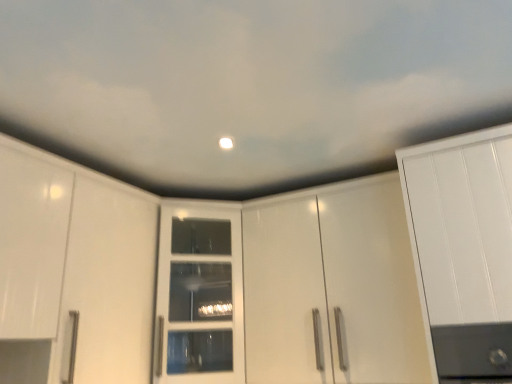
Question: Considering the positions of white glossy cabinet door at center and glossy white cabinet at center in the image, is white glossy cabinet door at center taller or shorter than glossy white cabinet at center?

Choices:
 (A) tall
 (B) short

Answer: (B)

Question: From a real-world perspective, is white glossy cabinet door at center above or below glossy white cabinet at center?

Choices:
 (A) below
 (B) above

Answer: (B)

Question: Would you say white glossy cabinet door at center is inside or outside glossy white cabinet at center?

Choices:
 (A) outside
 (B) inside

Answer: (A)

Question: Is glossy white cabinet at center wider or thinner than white glossy cabinet door at center?

Choices:
 (A) thin
 (B) wide

Answer: (A)

Question: From their relative heights in the image, would you say glossy white cabinet at center is taller or shorter than white glossy cabinet door at center?

Choices:
 (A) short
 (B) tall

Answer: (B)

Question: In terms of size, does glossy white cabinet at center appear bigger or smaller than white glossy cabinet door at center?

Choices:
 (A) big
 (B) small

Answer: (A)

Question: Is glossy white cabinet at center in front of or behind white glossy cabinet door at center in the image?

Choices:
 (A) behind
 (B) front

Answer: (B)